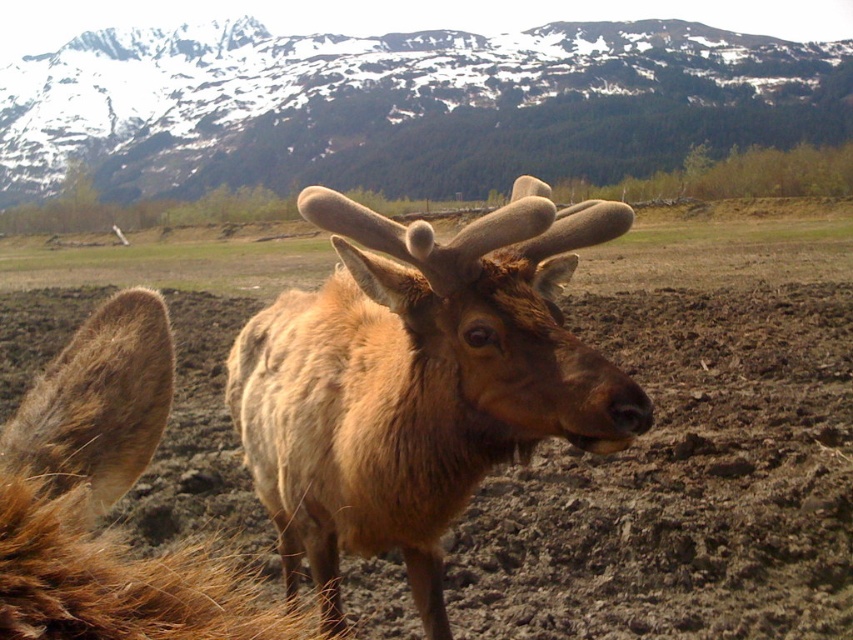
Find the location of `brown velvet antlers at center`. brown velvet antlers at center is located at coordinates (418, 381).

Between brown velvet antlers at center and brown fuzzy deer at center, which one has less height?

brown fuzzy deer at center

What do you see at coordinates (418, 381) in the screenshot? The width and height of the screenshot is (853, 640). I see `brown velvet antlers at center` at bounding box center [418, 381].

At what (x,y) coordinates should I click in order to perform the action: click on brown velvet antlers at center. Please return your answer as a coordinate pair (x, y). This screenshot has width=853, height=640. Looking at the image, I should click on (418, 381).

Does brown muddy field at center lie in front of brown velvet antlers at center?

No, brown muddy field at center is further to the viewer.

Is brown muddy field at center positioned at the back of brown velvet antlers at center?

Yes, brown muddy field at center is behind brown velvet antlers at center.

Does point (704, 624) lie in front of point (434, 362)?

No, it is not.

Find the location of `brown muddy field at center`. brown muddy field at center is located at coordinates (689, 445).

Between point (294, 76) and point (109, 628), which one is positioned in front?

Point (109, 628)

Is point (527, 74) closer to viewer compared to point (138, 566)?

No, it is not.

At what (x,y) coordinates should I click in order to perform the action: click on snowy rock mountain at upper center. Please return your answer as a coordinate pair (x, y). This screenshot has width=853, height=640. Looking at the image, I should click on (383, 99).